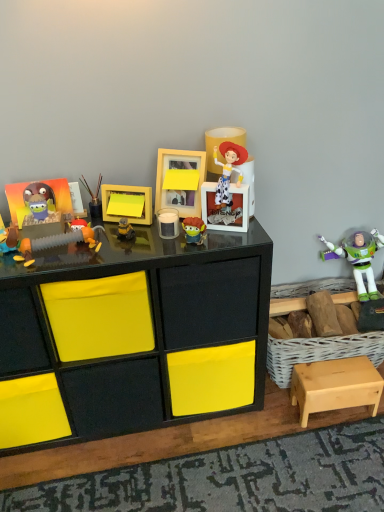
You are a GUI agent. You are given a task and a screenshot of the screen. Output one action in this format:
    pyautogui.click(x=<x>, y=<y>)
    Task: Click on the vacant region in front of matte orange toy at center-left, which ranks as the 5th toy in right-to-left order
    The image size is (384, 512).
    Given the screenshot: What is the action you would take?
    pyautogui.click(x=76, y=263)